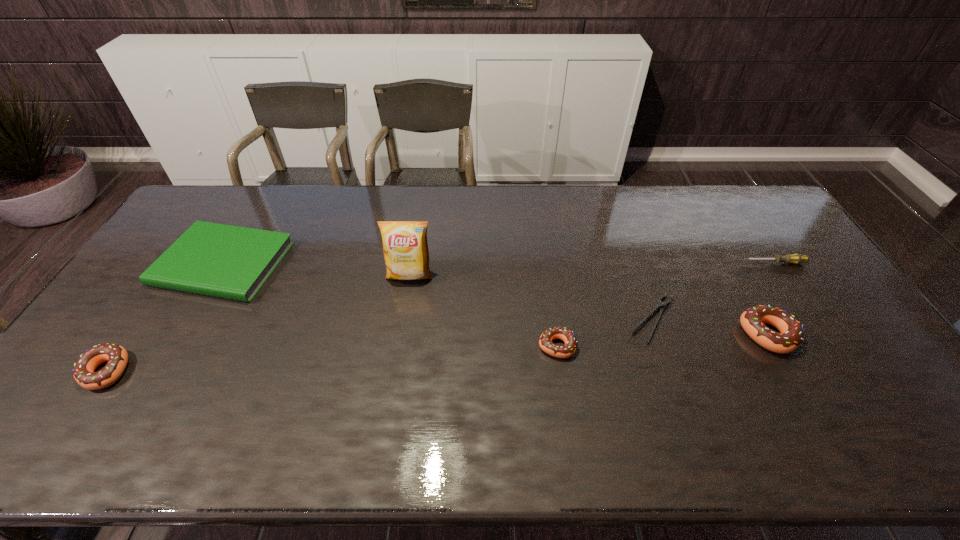
To ensure equal spacing by inserting another doughnut among them, please point out a vacant spot for this new doughnut. Please provide its 2D coordinates. Your answer should be formatted as a tuple, i.e. [(x, y)], where the tuple contains the x and y coordinates of a point satisfying the conditions above.

[(337, 359)]